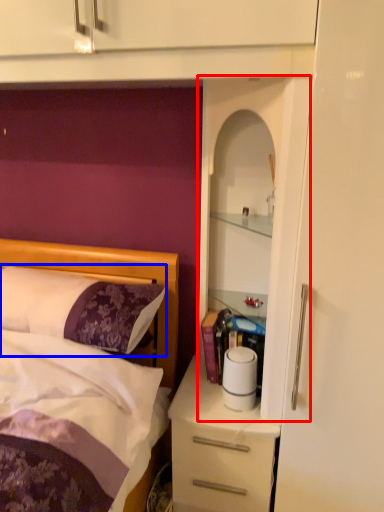
Question: Among these objects, which one is nearest to the camera, cabinet (highlighted by a red box) or pillow (highlighted by a blue box)?

Choices:
 (A) cabinet
 (B) pillow

Answer: (A)